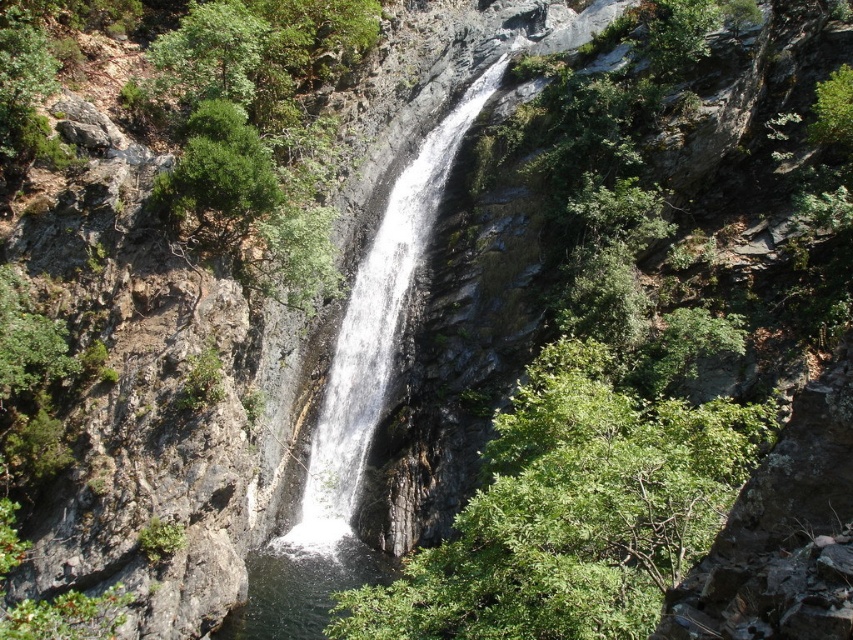
You are standing at the edge of the cliff overlooking the waterfall. You notice two distinct areas of water below you. Which area of water is located higher up, the white frothy water at center or the clear water at center?

The white frothy water at center is positioned over the clear water at center, so the white frothy water at center is higher up.

Based on the photo, you are standing at the base of the waterfall and want to cross from the left side to the right side. The clear water at center is calm and the white frothy water at center is turbulent. Which side should you step on to avoid getting wet?

You should step on the clear water at center to avoid getting wet because the white frothy water at center is turbulent and likely to splash more.